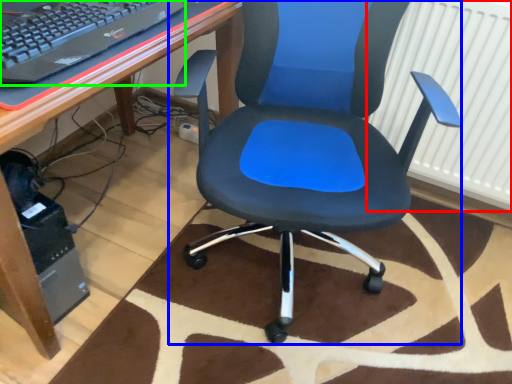
Question: Estimate the real-world distances between objects in this image. Which object is closer to radiator (highlighted by a red box), chair (highlighted by a blue box) or computer keyboard (highlighted by a green box)?

Choices:
 (A) chair
 (B) computer keyboard

Answer: (A)